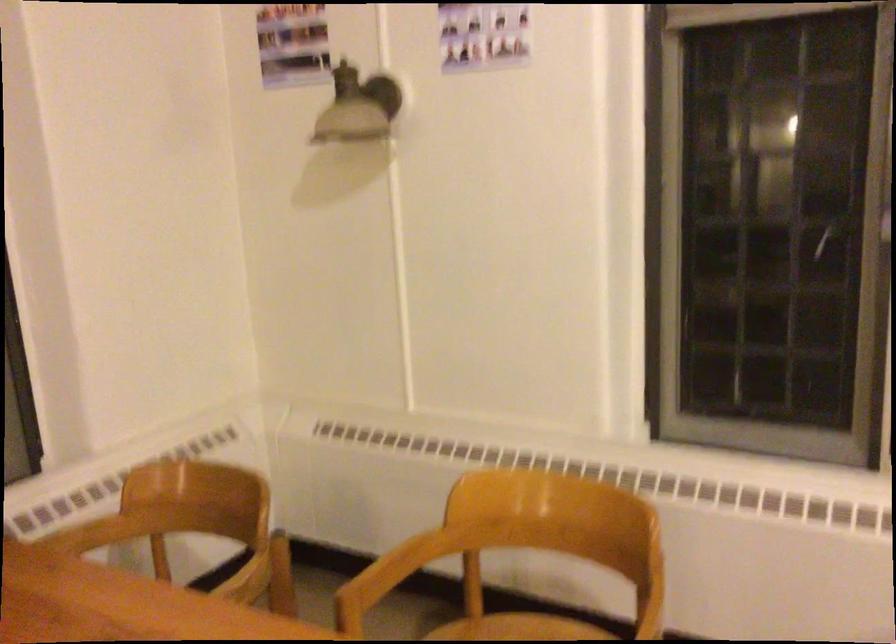
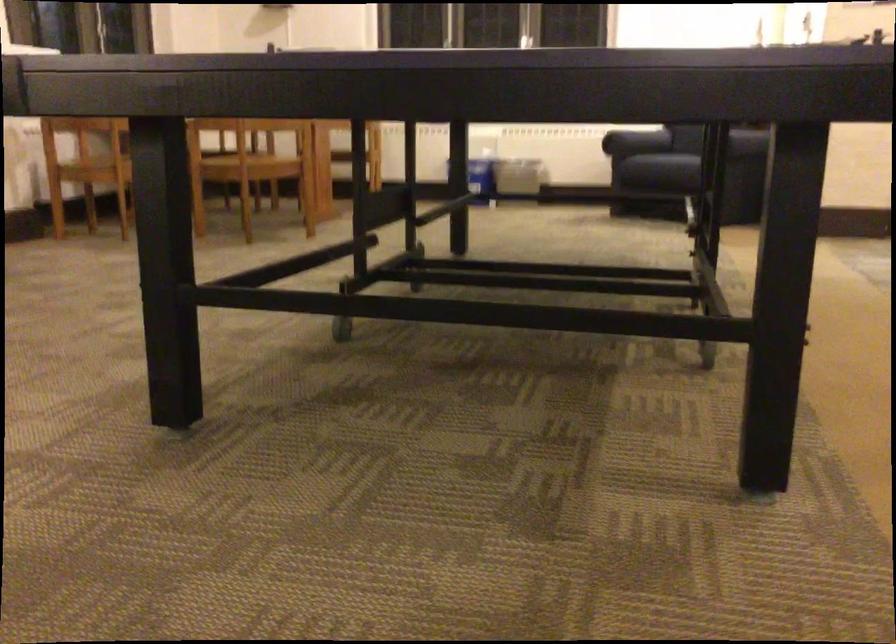
Question: I am providing you with two images of the same scene from different viewpoints. Please identify which objects are invisible in image2.

Choices:
 (A) sofa armrest
 (B) wooden chair armrest
 (C) chair sitting surface
 (D) small toy motorcycle

Answer: (B)